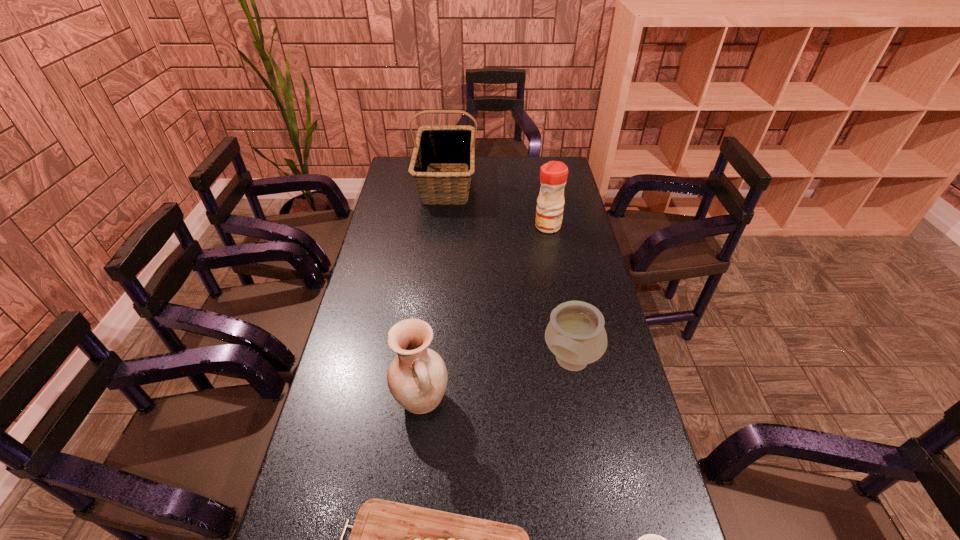
Where is `the farthest object`? The height and width of the screenshot is (540, 960). the farthest object is located at coordinates (437, 145).

Find the location of a particular element. Image resolution: width=960 pixels, height=540 pixels. basket is located at coordinates (437, 145).

Where is `condiment`? The image size is (960, 540). condiment is located at coordinates (553, 175).

At what (x,y) coordinates should I click in order to perform the action: click on the left pottery. Please return your answer as a coordinate pair (x, y). Image resolution: width=960 pixels, height=540 pixels. Looking at the image, I should click on (417, 377).

Where is `the right pottery`? Image resolution: width=960 pixels, height=540 pixels. the right pottery is located at coordinates (575, 334).

Find the location of `the shorter pottery`. the shorter pottery is located at coordinates (575, 334).

Locate an element on the screen. free space located 0.290m by the handle of the farthest object is located at coordinates (439, 255).

You are a GUI agent. You are given a task and a screenshot of the screen. Output one action in this format:
    pyautogui.click(x=<x>, y=<y>)
    Task: Click on the vacant area situated on the left of the condiment
    Image resolution: width=960 pixels, height=540 pixels.
    Given the screenshot: What is the action you would take?
    pyautogui.click(x=482, y=226)

Where is `free spot located 0.200m on the back of the left pottery`? free spot located 0.200m on the back of the left pottery is located at coordinates (430, 323).

In order to click on vacant space located on the back of the shorter pottery in this screenshot , I will do `click(554, 268)`.